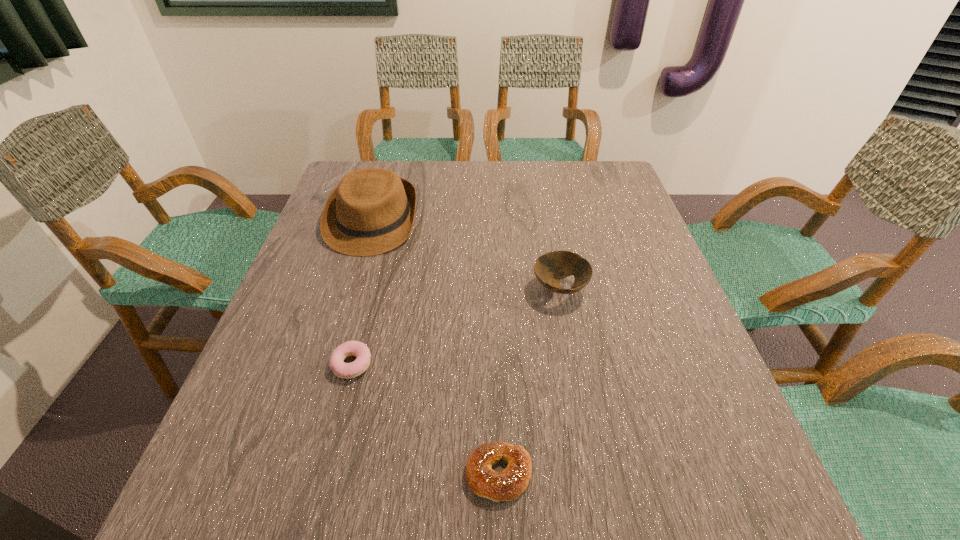
I want to click on free space located on the left of the nearest object, so click(390, 474).

This screenshot has width=960, height=540. Identify the location of object that is at the far edge. (371, 211).

Where is `object located at the near edge`? object located at the near edge is located at coordinates (507, 485).

I want to click on fedora present at the left edge, so click(x=371, y=211).

Identify the location of doughnut positioned at the left edge. (358, 349).

Locate an element on the screen. object that is at the far left corner is located at coordinates (371, 211).

Where is `free spot at the far edge of the desktop`? free spot at the far edge of the desktop is located at coordinates (433, 166).

At what (x,y) coordinates should I click in order to perform the action: click on blank space at the near edge of the desktop. Please return your answer as a coordinate pair (x, y). This screenshot has width=960, height=540. Looking at the image, I should click on pyautogui.click(x=433, y=523).

Where is `vacant space at the left edge of the desktop`? The width and height of the screenshot is (960, 540). vacant space at the left edge of the desktop is located at coordinates (320, 247).

Identify the location of free space at the right edge of the desktop. (610, 239).